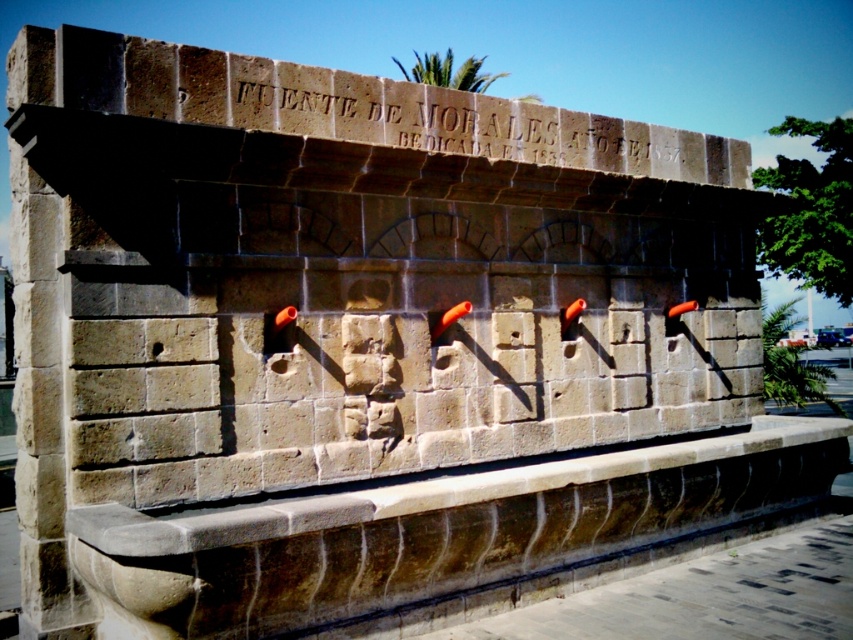
Question: Does smooth stone ledge at center appear under stone inscription at upper center?

Choices:
 (A) yes
 (B) no

Answer: (A)

Question: Which point is closer to the camera?

Choices:
 (A) (439, 140)
 (B) (326, 614)

Answer: (B)

Question: Which object appears closest to the camera in this image?

Choices:
 (A) smooth stone ledge at center
 (B) stone inscription at upper center

Answer: (B)

Question: Does smooth stone ledge at center appear over stone inscription at upper center?

Choices:
 (A) no
 (B) yes

Answer: (A)

Question: From the image, what is the correct spatial relationship of smooth stone ledge at center in relation to stone inscription at upper center?

Choices:
 (A) above
 (B) below

Answer: (B)

Question: Which of the following is the farthest from the observer?

Choices:
 (A) (299, 534)
 (B) (245, 124)

Answer: (B)